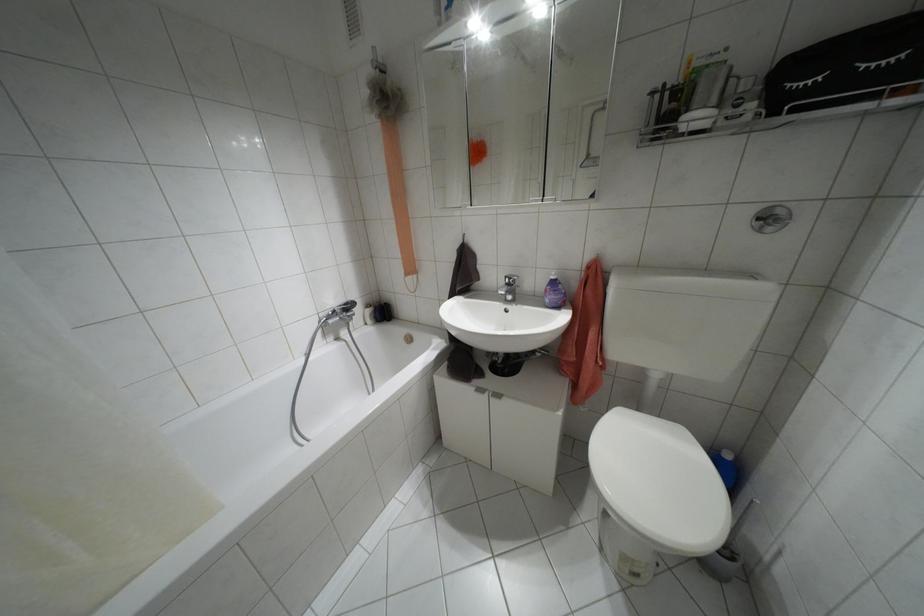
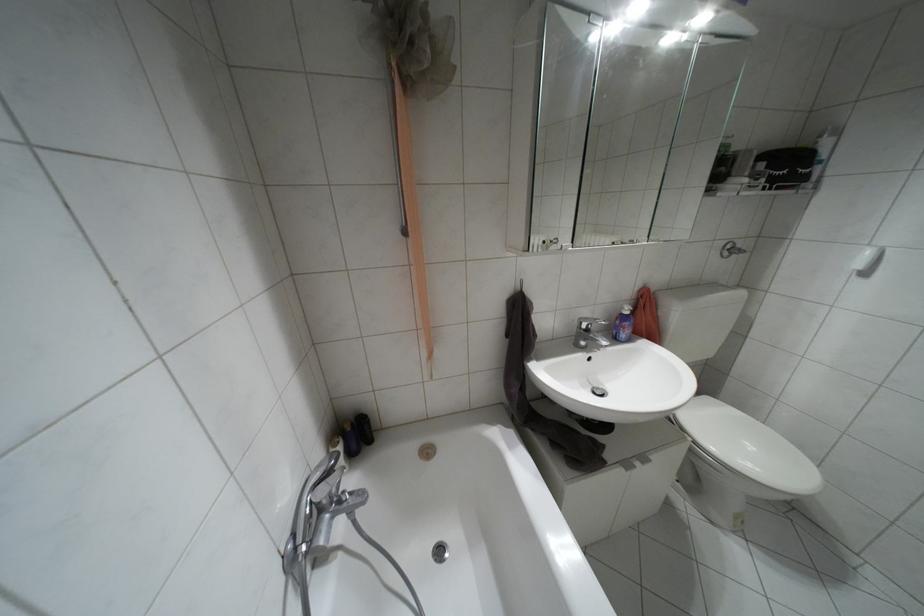
The point at (552, 277) is marked in the first image. Where is the corresponding point in the second image?

(626, 312)